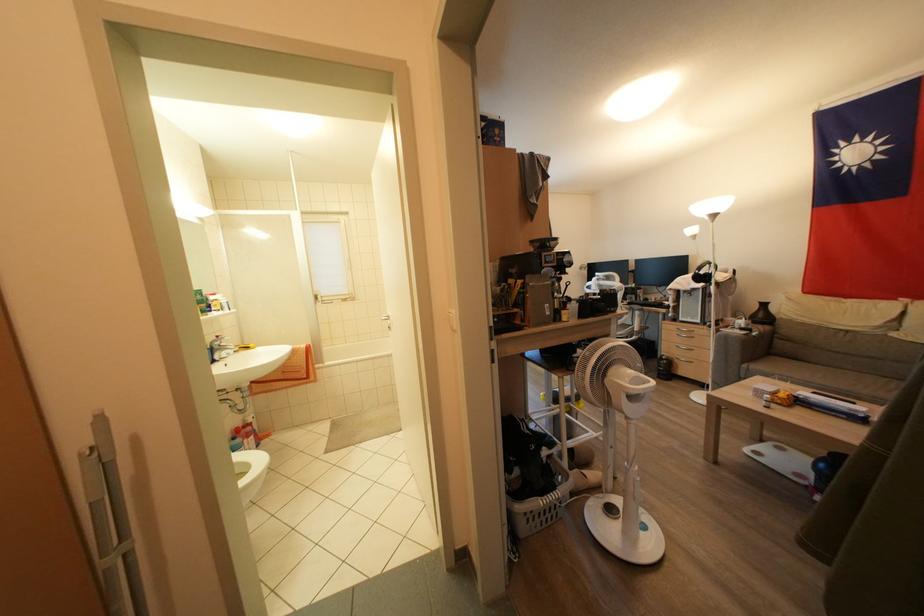
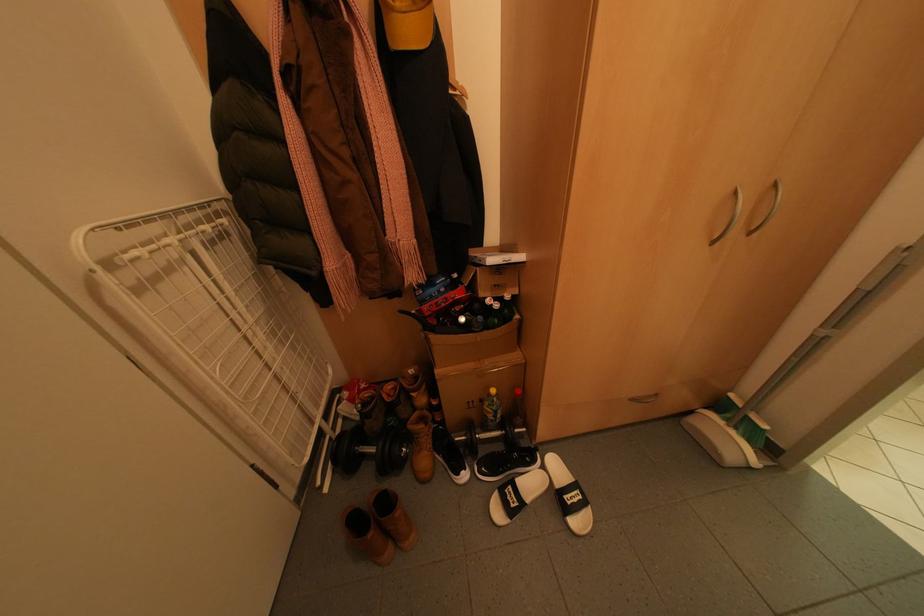
First-person continuous shooting, in which direction is the camera rotating?

The camera's rotation is toward left-down.